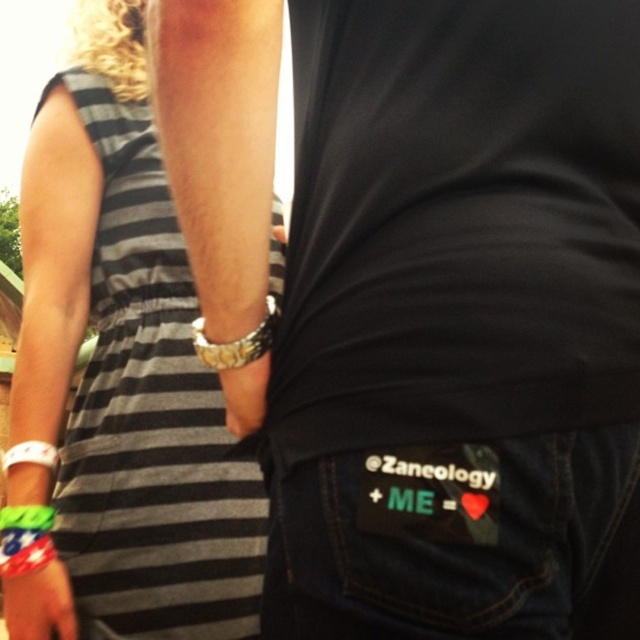
Based on the scene description, can you identify the object located at the coordinates point (38,604)?

The object at point (38,604) is the rubber wristband at lower left.

You are a fashion designer analyzing the image. You need to determine which item has a bigger size between the black striped dress at left and the rubber wristband at lower left. Which one is larger?

The black striped dress at left has a larger size compared to the rubber wristband at lower left, so the black striped dress at left is larger.

You are a fashion designer analyzing the image. You need to determine the spatial relationship between the black striped dress at left and the rubber wristband at lower left. Which object is located to the right of the other?

The black striped dress at left is positioned on the right side of rubber wristband at lower left.